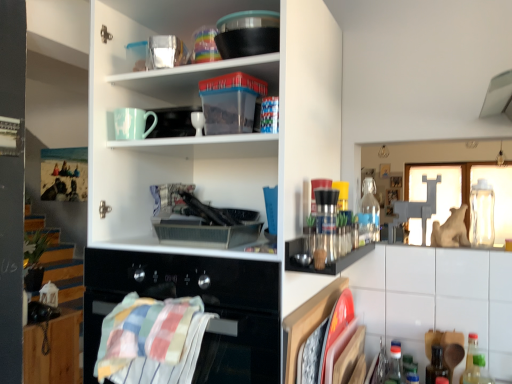
Question: Could you tell me if blue plastic bottle at lower right, which is counted as the 4th bottle, starting from the back, is turned towards white matte cupboard at upper left?

Choices:
 (A) yes
 (B) no

Answer: (B)

Question: Is blue plastic bottle at lower right, arranged as the second bottle when viewed from the front, smaller than white matte cupboard at upper left?

Choices:
 (A) yes
 (B) no

Answer: (A)

Question: Does blue plastic bottle at lower right, which is counted as the 4th bottle, starting from the back, have a greater width compared to white matte cupboard at upper left?

Choices:
 (A) no
 (B) yes

Answer: (A)

Question: Is the position of blue plastic bottle at lower right, arranged as the second bottle when viewed from the front, less distant than that of white matte cupboard at upper left?

Choices:
 (A) yes
 (B) no

Answer: (B)

Question: Is blue plastic bottle at lower right, the third bottle when ordered from left to right, further to camera compared to white matte cupboard at upper left?

Choices:
 (A) yes
 (B) no

Answer: (A)

Question: Does point (412, 379) appear closer or farther from the camera than point (119, 347)?

Choices:
 (A) farther
 (B) closer

Answer: (A)

Question: From their relative heights in the image, would you say blue plastic bottle at lower right, the third bottle from the right, is taller or shorter than striped cotton towel at lower left?

Choices:
 (A) short
 (B) tall

Answer: (A)

Question: Do you think blue plastic bottle at lower right, the third bottle when ordered from left to right, is within striped cotton towel at lower left, or outside of it?

Choices:
 (A) outside
 (B) inside

Answer: (A)

Question: Is blue plastic bottle at lower right, which is counted as the 4th bottle, starting from the back, to the left or to the right of striped cotton towel at lower left in the image?

Choices:
 (A) left
 (B) right

Answer: (B)

Question: Is striped cotton towel at lower left bigger or smaller than wooden cabinet at lower left, the 2th cabinetry from the right?

Choices:
 (A) big
 (B) small

Answer: (B)

Question: Does point (129, 304) appear closer or farther from the camera than point (60, 309)?

Choices:
 (A) closer
 (B) farther

Answer: (A)

Question: From a real-world perspective, is striped cotton towel at lower left above or below wooden cabinet at lower left, arranged as the 1th cabinetry when viewed from the left?

Choices:
 (A) below
 (B) above

Answer: (B)

Question: From the image's perspective, relative to wooden cabinet at lower left, the 1th cabinetry in the bottom-to-top sequence, is striped cotton towel at lower left above or below?

Choices:
 (A) above
 (B) below

Answer: (A)

Question: Considering the positions of point (501, 349) and point (409, 360), is point (501, 349) closer or farther from the camera than point (409, 360)?

Choices:
 (A) farther
 (B) closer

Answer: (A)

Question: Looking at their shapes, would you say white glossy cabinet at lower right, the 2th cabinetry in the left-to-right sequence, is wider or thinner than blue plastic bottle at lower right, arranged as the second bottle when viewed from the front?

Choices:
 (A) thin
 (B) wide

Answer: (A)